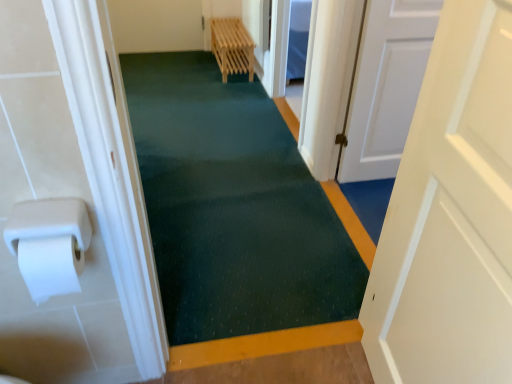
Question: Based on their positions, is white matte paper towel at left located to the left or right of white matte door at right, the second door when ordered from back to front?

Choices:
 (A) left
 (B) right

Answer: (A)

Question: Is white matte paper towel at left situated inside white matte door at right, acting as the 1th door starting from the front, or outside?

Choices:
 (A) inside
 (B) outside

Answer: (B)

Question: Estimate the real-world distances between objects in this image. Which object is closer to the white matte door at right, the second door when ordered from back to front?

Choices:
 (A) white matte door at center, positioned as the second door in left-to-right order
 (B) green textured carpet at center
 (C) white matte paper towel at left
 (D) wooden rack at center

Answer: (C)

Question: Which is farther from the white matte door at right, the second door when ordered from back to front?

Choices:
 (A) white matte door at center, which ranks as the first door in back-to-front order
 (B) wooden rack at center
 (C) white matte paper towel at left
 (D) green textured carpet at center

Answer: (B)